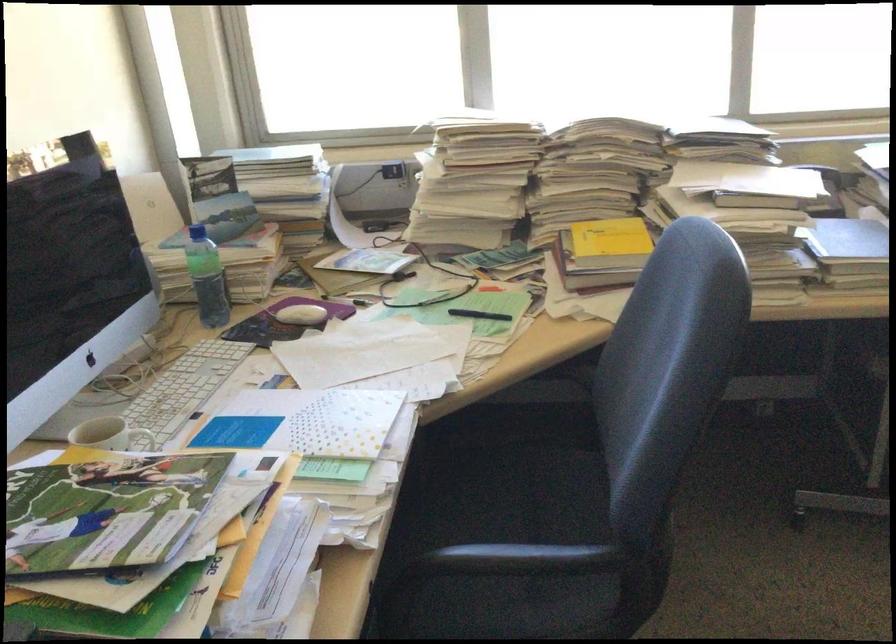
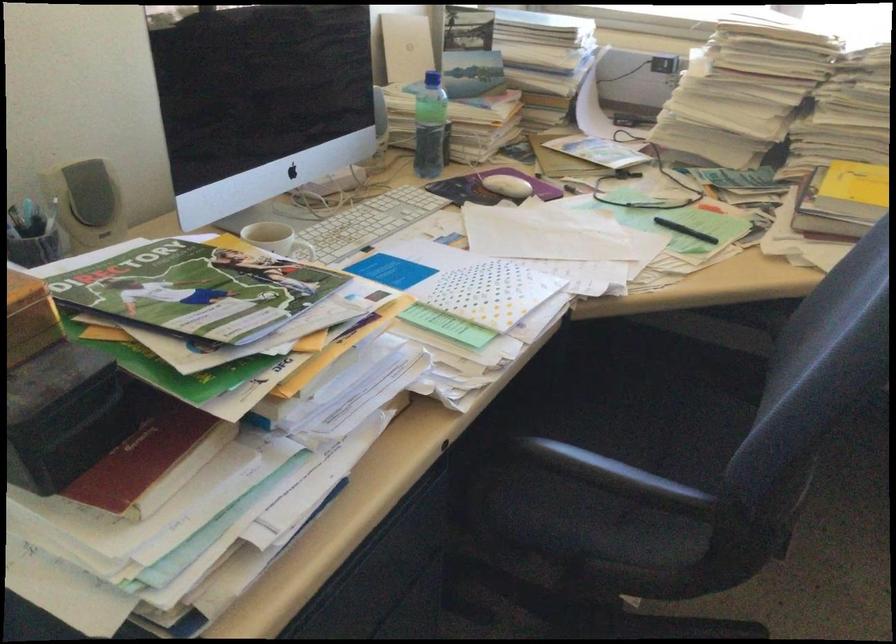
The point at (304, 317) is marked in the first image. Where is the corresponding point in the second image?

(506, 185)